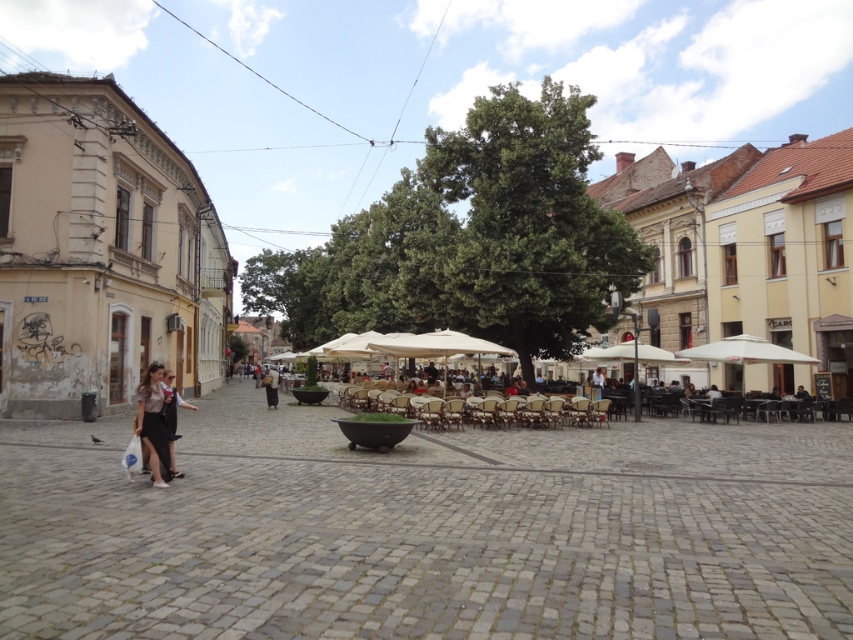
Question: Which of the following is the farthest from the observer?

Choices:
 (A) white fabric umbrella at center
 (B) matte black dress at lower left
 (C) dark brown leather jacket at center

Answer: (C)

Question: Does matte black dress at lower left appear over white fabric umbrella at center?

Choices:
 (A) no
 (B) yes

Answer: (A)

Question: Estimate the real-world distances between objects in this image. Which object is closer to the dark brown leather jacket at center?

Choices:
 (A) white fabric umbrella at center
 (B) matte black jacket at lower left

Answer: (A)

Question: Which object is farther from the camera taking this photo?

Choices:
 (A) white fabric umbrella at center
 (B) matte black dress at lower left
 (C) dark brown leather jacket at center

Answer: (C)

Question: Does matte black dress at lower left have a greater width compared to matte black jacket at lower left?

Choices:
 (A) no
 (B) yes

Answer: (B)

Question: Observing the image, what is the correct spatial positioning of white fabric umbrella at center in reference to matte black jacket at lower left?

Choices:
 (A) left
 (B) right

Answer: (B)